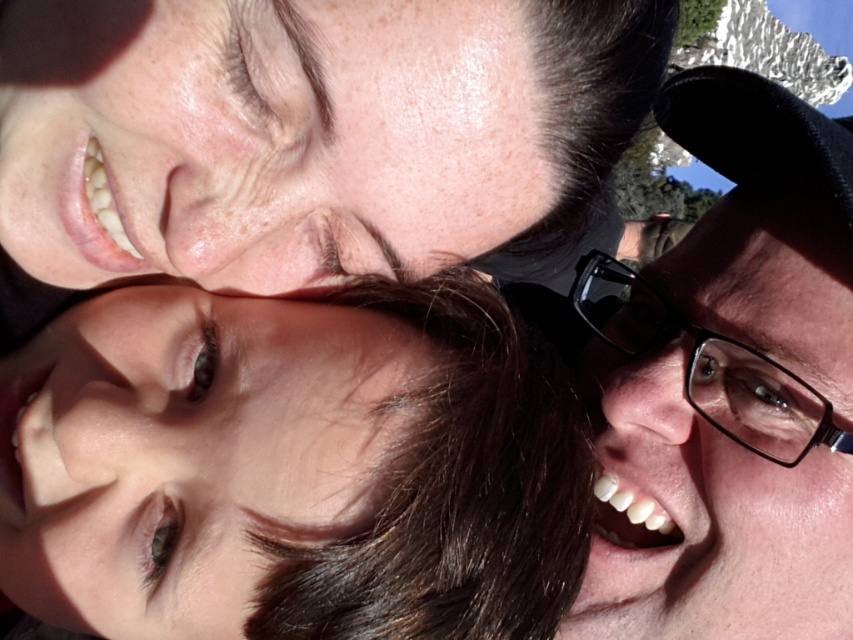
Question: Is black plastic glasses at right positioned in front of black plastic glasses at upper right?

Choices:
 (A) no
 (B) yes

Answer: (B)

Question: Is smooth brown hair at center smaller than black plastic glasses at right?

Choices:
 (A) no
 (B) yes

Answer: (B)

Question: Which object appears farthest from the camera in this image?

Choices:
 (A) smooth brown hair at center
 (B) black plastic glasses at upper right

Answer: (B)

Question: Which object is positioned farthest from the black plastic glasses at upper right?

Choices:
 (A) black plastic glasses at right
 (B) smooth brown hair at center

Answer: (B)

Question: Is smooth brown hair at center wider than black plastic glasses at upper right?

Choices:
 (A) no
 (B) yes

Answer: (B)

Question: Which object is closer to the camera taking this photo?

Choices:
 (A) black plastic glasses at right
 (B) black plastic glasses at upper right

Answer: (A)